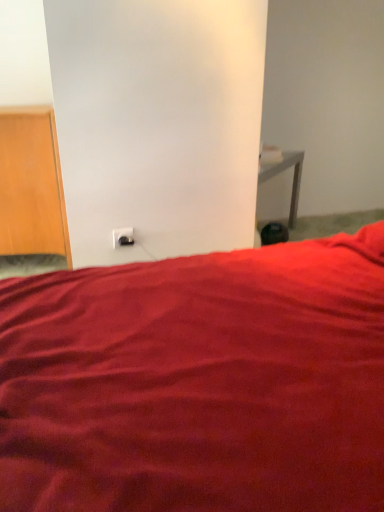
Where is `white plastic electric outlet at lower center`? The height and width of the screenshot is (512, 384). white plastic electric outlet at lower center is located at coordinates (122, 237).

What is the approximate height of matte red bed at center?

15.91 inches.

Identify the location of wooden door at left. The image size is (384, 512). (31, 184).

Considering the relative positions of matte red bed at center and wooden door at left in the image provided, is matte red bed at center behind wooden door at left?

No, matte red bed at center is closer to the viewer.

Between point (68, 473) and point (6, 188), which one is positioned in front?

The point (68, 473) is closer.

Where is `bed on the right of wooden door at left`? bed on the right of wooden door at left is located at coordinates (198, 382).

Is matte red bed at center wider than wooden door at left?

Yes, matte red bed at center is wider than wooden door at left.

From the image's perspective, is wooden door at left on matte red bed at center?

Yes, from the image's perspective, wooden door at left is above matte red bed at center.

In the image, is wooden door at left positioned in front of or behind matte red bed at center?

In the image, wooden door at left appears behind matte red bed at center.

This screenshot has height=512, width=384. In order to click on furniture that appears above the matte red bed at center (from the image's perspective) in this screenshot , I will do `click(31, 184)`.

Is matte red bed at center located within wooden door at left?

No, matte red bed at center is not a part of wooden door at left.

The width and height of the screenshot is (384, 512). I want to click on furniture in front of the white plastic electric outlet at lower center, so click(x=31, y=184).

Would you say white plastic electric outlet at lower center is to the left or to the right of wooden door at left in the picture?

In the image, white plastic electric outlet at lower center appears on the right side of wooden door at left.

Is matte red bed at center positioned with its back to white plastic electric outlet at lower center?

No, white plastic electric outlet at lower center is not at the back of matte red bed at center.

Who is smaller, matte red bed at center or white plastic electric outlet at lower center?

white plastic electric outlet at lower center.

Does matte red bed at center have a greater height compared to white plastic electric outlet at lower center?

Yes, matte red bed at center is taller than white plastic electric outlet at lower center.

Is white plastic electric outlet at lower center not near matte red bed at center?

white plastic electric outlet at lower center is actually quite close to matte red bed at center.

In the scene shown: From a real-world perspective, is white plastic electric outlet at lower center positioned above or below matte red bed at center?

white plastic electric outlet at lower center is above matte red bed at center.

From the image's perspective, would you say white plastic electric outlet at lower center is shown under matte red bed at center?

No, from the image's perspective, white plastic electric outlet at lower center is not below matte red bed at center.

Which object is more forward, white plastic electric outlet at lower center or matte red bed at center?

matte red bed at center is more forward.

Does point (57, 201) lie behind point (127, 245)?

Yes.

How far apart are wooden door at left and white plastic electric outlet at lower center?

wooden door at left and white plastic electric outlet at lower center are 19.51 inches apart.

Is wooden door at left facing towards white plastic electric outlet at lower center?

No.

Identify the location of electric outlet below the wooden door at left (from a real-world perspective). (122, 237).

Locate an element on the screen. bed in front of the wooden door at left is located at coordinates (198, 382).

Where is `bed that appears below the wooden door at left (from a real-world perspective)`? bed that appears below the wooden door at left (from a real-world perspective) is located at coordinates (198, 382).

When comparing their distances from wooden door at left, does white plastic electric outlet at lower center or matte red bed at center seem closer?

The object closer to wooden door at left is white plastic electric outlet at lower center.

Estimate the real-world distances between objects in this image. Which object is further from white plastic electric outlet at lower center, matte red bed at center or wooden door at left?

matte red bed at center.

Based on the photo, considering their positions, is matte red bed at center positioned closer to wooden door at left than white plastic electric outlet at lower center?

Based on the image, white plastic electric outlet at lower center appears to be nearer to wooden door at left.

From the image, which object appears to be farther from white plastic electric outlet at lower center, wooden door at left or matte red bed at center?

matte red bed at center.

Looking at this image, when comparing their distances from matte red bed at center, does wooden door at left or white plastic electric outlet at lower center seem further?

wooden door at left lies further to matte red bed at center than the other object.

Based on the photo, when comparing their distances from matte red bed at center, does white plastic electric outlet at lower center or wooden door at left seem closer?

Among the two, white plastic electric outlet at lower center is located nearer to matte red bed at center.

You are a GUI agent. You are given a task and a screenshot of the screen. Output one action in this format:
    pyautogui.click(x=<x>, y=<y>)
    Task: Click on the furniture between matte red bed at center and white plastic electric outlet at lower center in the front-back direction
    This screenshot has height=512, width=384.
    Given the screenshot: What is the action you would take?
    pyautogui.click(x=31, y=184)